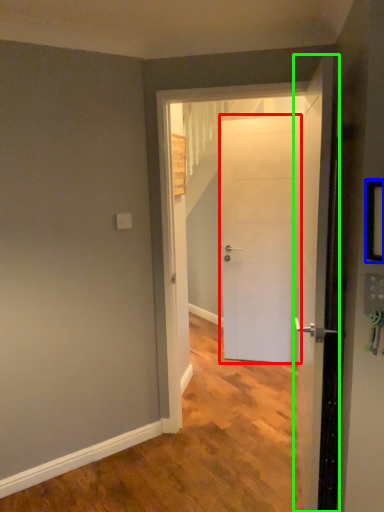
Question: Considering the real-world distances, which object is closest to door (highlighted by a red box)? picture frame (highlighted by a blue box) or door (highlighted by a green box).

Choices:
 (A) picture frame
 (B) door

Answer: (B)